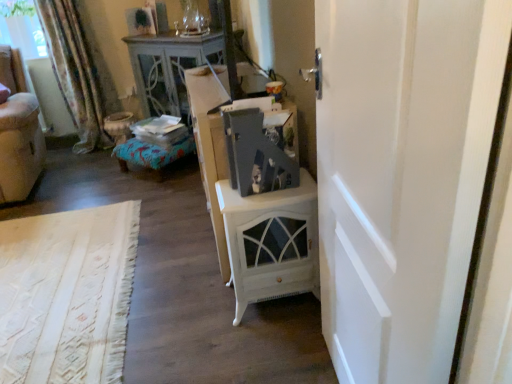
Question: Does white painted wood nightstand at center lie in front of velvet beige armchair at left?

Choices:
 (A) yes
 (B) no

Answer: (A)

Question: From the image's perspective, is white painted wood nightstand at center below velvet beige armchair at left?

Choices:
 (A) yes
 (B) no

Answer: (A)

Question: Is white painted wood nightstand at center thinner than velvet beige armchair at left?

Choices:
 (A) yes
 (B) no

Answer: (A)

Question: Is white painted wood nightstand at center not close to velvet beige armchair at left?

Choices:
 (A) no
 (B) yes

Answer: (B)

Question: Is white painted wood nightstand at center bigger than velvet beige armchair at left?

Choices:
 (A) yes
 (B) no

Answer: (B)

Question: From a real-world perspective, is transparent glass window screen at upper left positioned above or below white painted wood nightstand at center?

Choices:
 (A) above
 (B) below

Answer: (A)

Question: Is transparent glass window screen at upper left to the left or to the right of white painted wood nightstand at center in the image?

Choices:
 (A) left
 (B) right

Answer: (A)

Question: Is transparent glass window screen at upper left in front of or behind white painted wood nightstand at center in the image?

Choices:
 (A) front
 (B) behind

Answer: (B)

Question: Does point (2, 9) appear closer or farther from the camera than point (274, 233)?

Choices:
 (A) farther
 (B) closer

Answer: (A)

Question: Considering the positions of point (438, 289) and point (212, 178), is point (438, 289) closer or farther from the camera than point (212, 178)?

Choices:
 (A) farther
 (B) closer

Answer: (B)

Question: Is white matte door at right spatially inside white glossy cabinet at center, or outside of it?

Choices:
 (A) outside
 (B) inside

Answer: (A)

Question: Is white matte door at right in front of or behind white glossy cabinet at center in the image?

Choices:
 (A) behind
 (B) front

Answer: (B)

Question: From a real-world perspective, is white matte door at right physically located above or below white glossy cabinet at center?

Choices:
 (A) below
 (B) above

Answer: (B)

Question: Is point (271, 286) closer or farther from the camera than point (96, 48)?

Choices:
 (A) closer
 (B) farther

Answer: (A)

Question: In terms of height, does white painted wood nightstand at center look taller or shorter compared to floral fabric curtain at left?

Choices:
 (A) short
 (B) tall

Answer: (A)